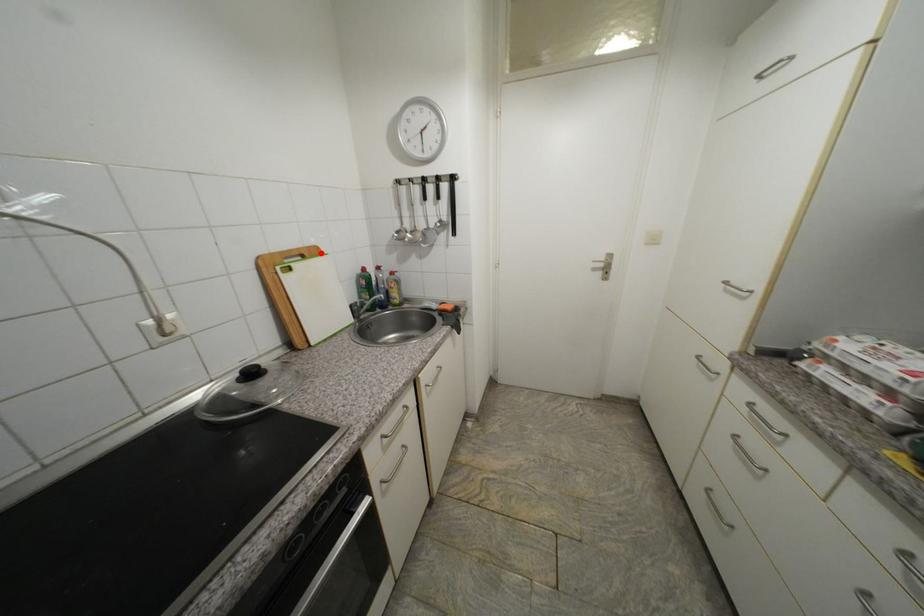
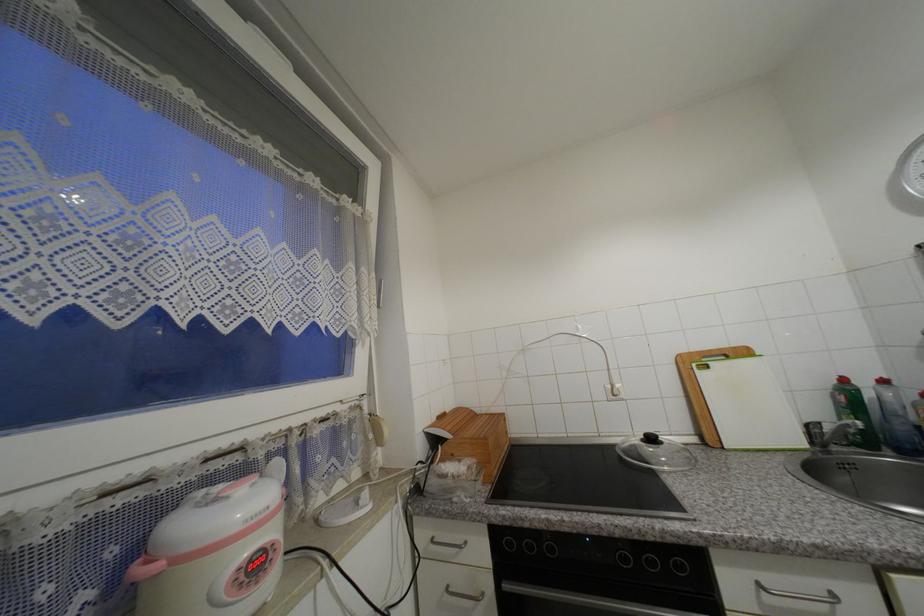
Question: I am providing you with two images of the same scene from different viewpoints. Given a red point in image1, look at the same physical point in image2. Is it:

Choices:
 (A) Closer to the viewpoint
 (B) Farther from the viewpoint

Answer: (B)